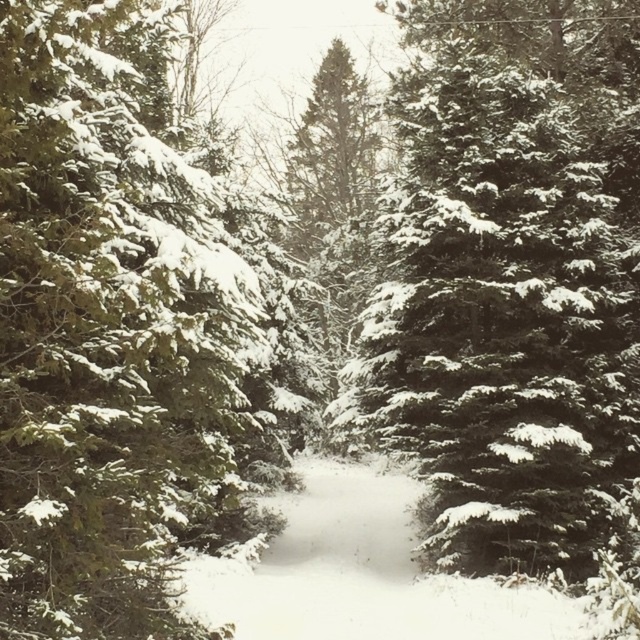
Can you confirm if green matte evergreen tree at left is taller than snow-covered evergreen at center?

In fact, green matte evergreen tree at left may be shorter than snow-covered evergreen at center.

Between green matte evergreen tree at left and snow-covered evergreen at center, which one is positioned lower?

green matte evergreen tree at left is lower down.

What do you see at coordinates (108, 333) in the screenshot? The image size is (640, 640). I see `green matte evergreen tree at left` at bounding box center [108, 333].

The height and width of the screenshot is (640, 640). I want to click on green matte evergreen tree at left, so click(108, 333).